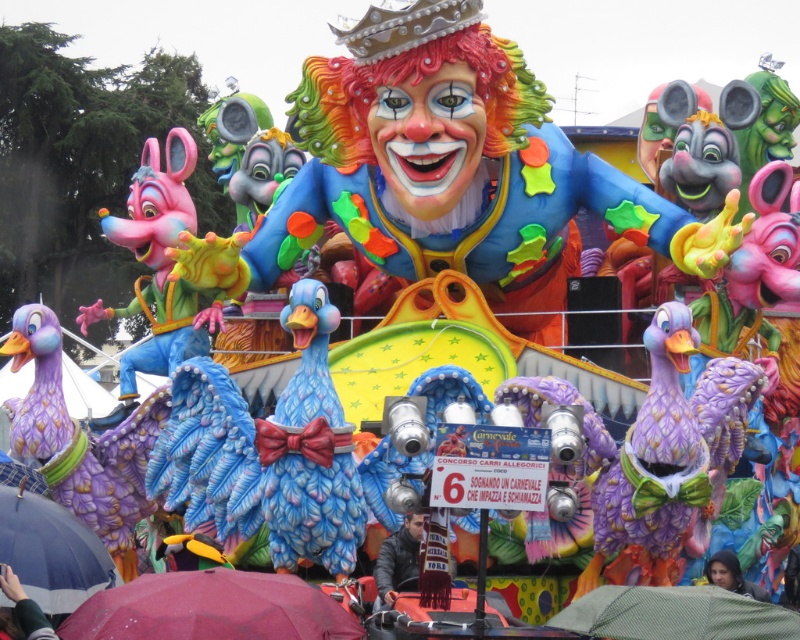
Between purple matte duck at center and dark gray fabric umbrella at lower left, which one has more height?

purple matte duck at center is taller.

Is point (678, 449) positioned after point (26, 600)?

Yes, point (678, 449) is farther from viewer.

Identify the location of purple matte duck at center. (670, 458).

Looking at this image, can you confirm if green mesh umbrella at lower center is thinner than dark gray jacket at center?

No.

Is point (660, 627) closer to camera compared to point (384, 589)?

Yes, it is in front of point (384, 589).

Which is behind, point (744, 605) or point (409, 545)?

Point (409, 545)

Find the location of a particular element. green mesh umbrella at lower center is located at coordinates (674, 614).

Who is positioned more to the left, shiny plastic clown at center or dark gray fabric umbrella at lower left?

dark gray fabric umbrella at lower left is more to the left.

Can you confirm if shiny plastic clown at center is positioned to the right of dark gray fabric umbrella at lower left?

Indeed, shiny plastic clown at center is positioned on the right side of dark gray fabric umbrella at lower left.

Who is more distant from viewer, (466,243) or (22,621)?

The point (466,243) is more distant.

The width and height of the screenshot is (800, 640). Identify the location of shiny plastic clown at center. (442, 168).